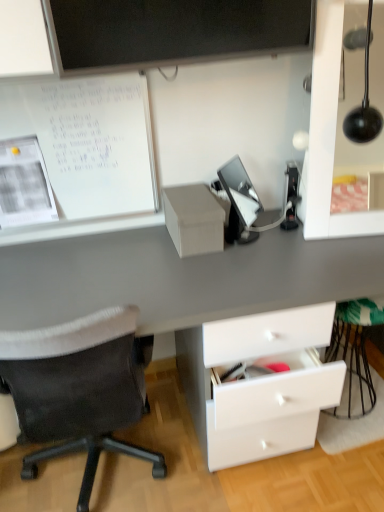
Question: Considering the positions of matte cardboard box at center and white matte paperboard at upper left in the image, is matte cardboard box at center wider or thinner than white matte paperboard at upper left?

Choices:
 (A) thin
 (B) wide

Answer: (B)

Question: Is matte cardboard box at center spatially inside white matte paperboard at upper left, or outside of it?

Choices:
 (A) outside
 (B) inside

Answer: (A)

Question: Estimate the real-world distances between objects in this image. Which object is farther from the matte black lamp at upper right?

Choices:
 (A) black fabric chair at left
 (B) matte cardboard box at center
 (C) white matte paperboard at upper left

Answer: (A)

Question: Which is farther from the matte cardboard box at center?

Choices:
 (A) black fabric chair at left
 (B) white matte paperboard at upper left
 (C) matte black lamp at upper right

Answer: (A)